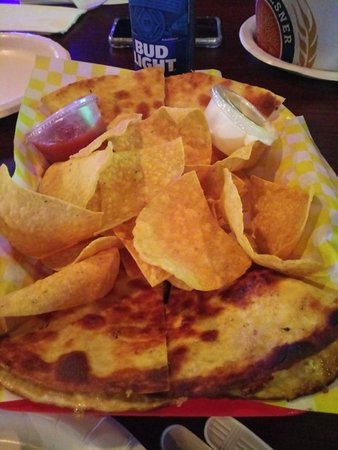
You are a GUI agent. You are given a task and a screenshot of the screen. Output one action in this format:
    pyautogui.click(x=<x>, y=<y>)
    Task: Click on the napkin
    The height and width of the screenshot is (450, 338).
    Given the screenshot: What is the action you would take?
    pyautogui.click(x=55, y=21)